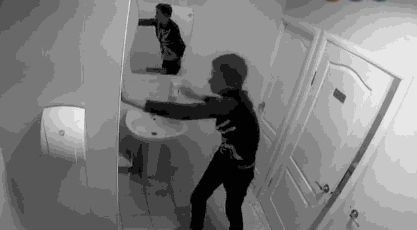
Identify the location of door knob. (259, 107), (321, 190).